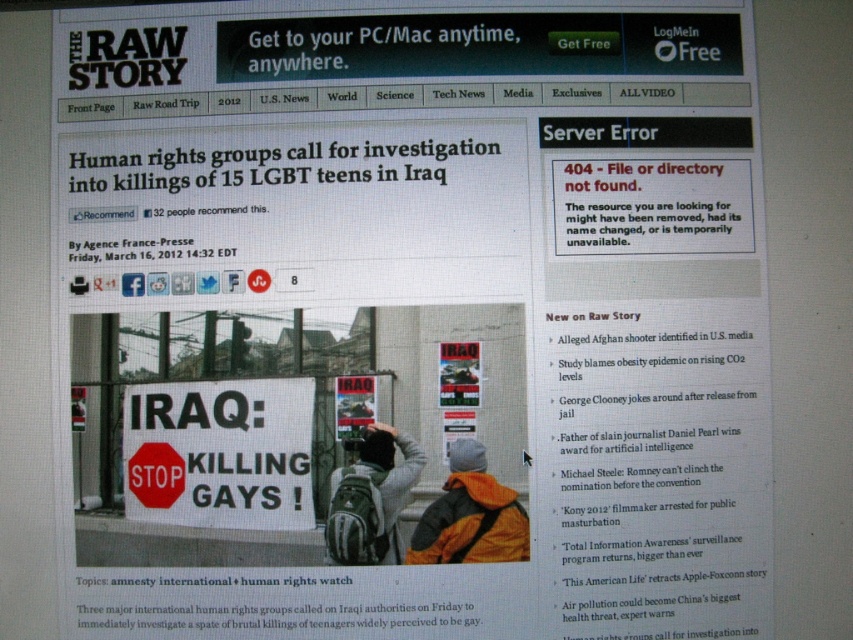
The height and width of the screenshot is (640, 853). What are the coordinates of `orange fabric jacket at center` in the screenshot? It's located at (469, 515).

Is orange fabric jacket at center wider than red matte stop sign at center?

Correct, the width of orange fabric jacket at center exceeds that of red matte stop sign at center.

Is point (450, 561) behind point (164, 456)?

No, (450, 561) is in front of (164, 456).

You are a GUI agent. You are given a task and a screenshot of the screen. Output one action in this format:
    pyautogui.click(x=<x>, y=<y>)
    Task: Click on the orange fabric jacket at center
    
    Given the screenshot: What is the action you would take?
    (x=469, y=515)

Does gray backpack at center have a lesser width compared to red matte stop sign at center?

In fact, gray backpack at center might be wider than red matte stop sign at center.

Is gray backpack at center positioned at the back of red matte stop sign at center?

That is False.

At what (x,y) coordinates should I click in order to perform the action: click on gray backpack at center. Please return your answer as a coordinate pair (x, y). This screenshot has height=640, width=853. Looking at the image, I should click on (370, 499).

Where is `gray backpack at center`? gray backpack at center is located at coordinates (370, 499).

Is orange fabric jacket at center smaller than gray backpack at center?

No, orange fabric jacket at center is not smaller than gray backpack at center.

What do you see at coordinates (469, 515) in the screenshot?
I see `orange fabric jacket at center` at bounding box center [469, 515].

Between point (457, 474) and point (410, 460), which one is positioned behind?

Positioned behind is point (410, 460).

Where is `orange fabric jacket at center`? The width and height of the screenshot is (853, 640). orange fabric jacket at center is located at coordinates (469, 515).